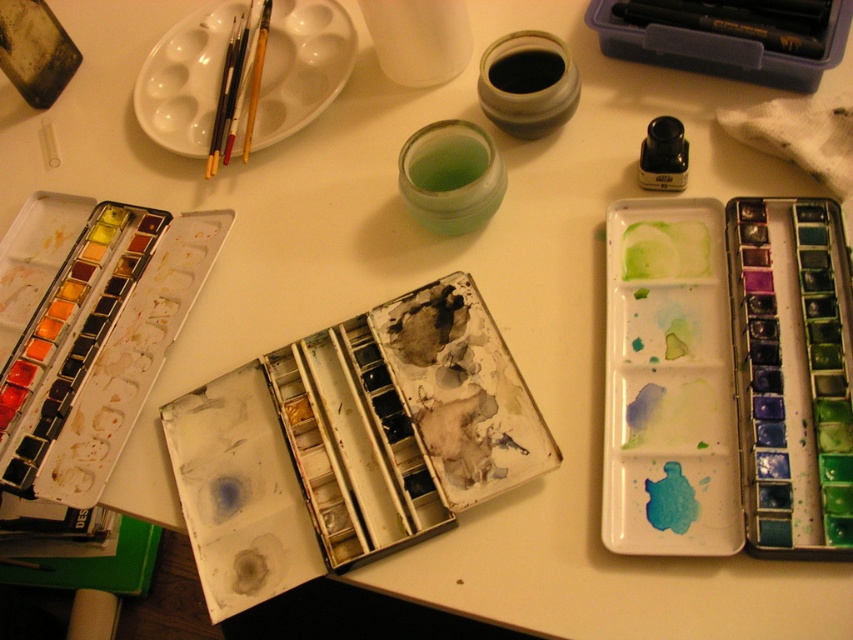
Question: Can you confirm if black plastic pencil at upper right is positioned below yellow wood paint brush at upper left?

Choices:
 (A) yes
 (B) no

Answer: (B)

Question: Is black plastic pencil at upper right to the right of yellow wood paint brush at upper left from the viewer's perspective?

Choices:
 (A) no
 (B) yes

Answer: (B)

Question: Which object appears closest to the camera in this image?

Choices:
 (A) black plastic pencil at upper right
 (B) yellow wood paint brush at upper left

Answer: (A)

Question: Does black plastic pencil at upper right have a greater width compared to yellow wood paint brush at upper left?

Choices:
 (A) yes
 (B) no

Answer: (A)

Question: Among these points, which one is farthest from the camera?

Choices:
 (A) (254, 81)
 (B) (706, 29)

Answer: (A)